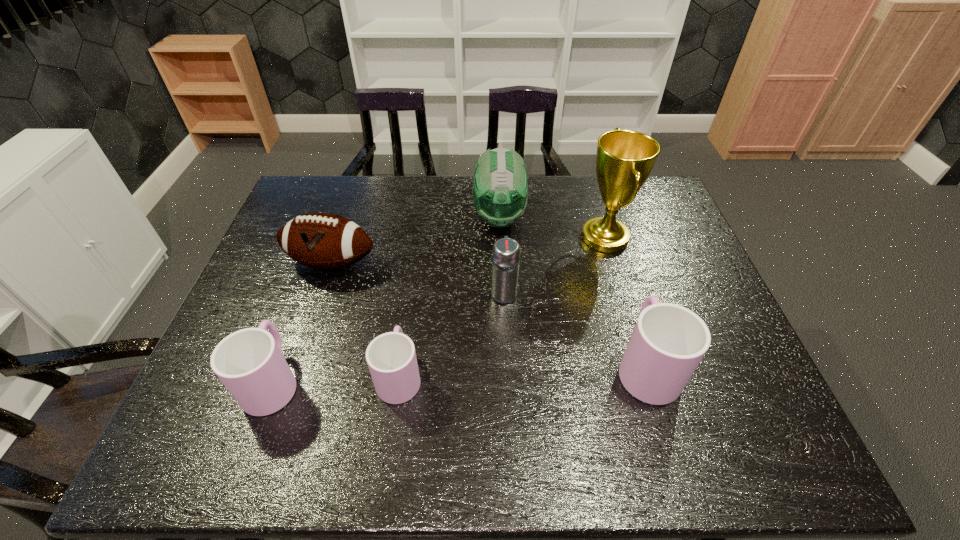
Where is `vacant spot for a new cup to ensure equal spacing`? vacant spot for a new cup to ensure equal spacing is located at coordinates (524, 370).